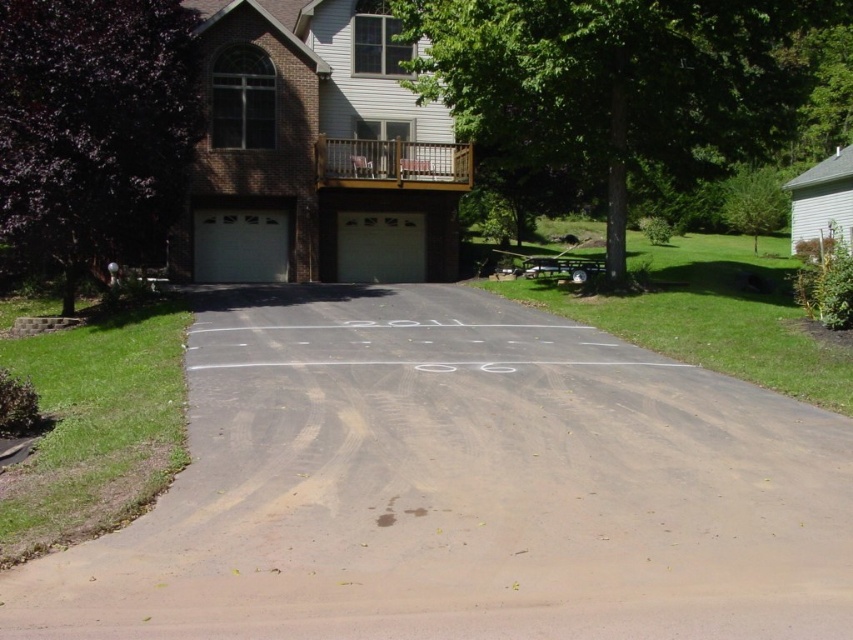
You are standing at the entrance of the house and want to park your car on the brown asphalt driveway at center. Based on the scene description, where exactly is the driveway located in relation to the house?

The brown asphalt driveway at center is located at point coordinates of [461,486]. This means it is positioned slightly to the right and above the center point of the image, making it accessible from the entrance.